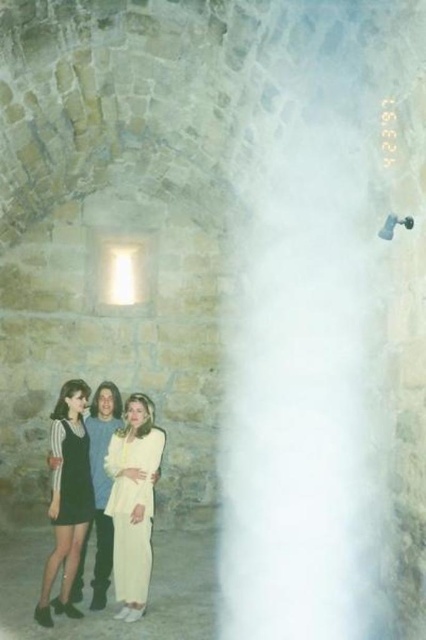
Who is shorter, light beige fabric skirt at lower left or matte black dress at left?

light beige fabric skirt at lower left

The image size is (426, 640). I want to click on light beige fabric skirt at lower left, so (x=112, y=592).

Is light yellow fabric dress at center shorter than black satin dress at left?

No.

You are a GUI agent. You are given a task and a screenshot of the screen. Output one action in this format:
    pyautogui.click(x=<x>, y=<y>)
    Task: Click on the light yellow fabric dress at center
    The image size is (426, 640).
    Given the screenshot: What is the action you would take?
    pyautogui.click(x=132, y=509)

Locate an element on the screen. The height and width of the screenshot is (640, 426). light yellow fabric dress at center is located at coordinates (132, 509).

Does light beige fabric skirt at lower left come behind light yellow fabric dress at center?

No, light beige fabric skirt at lower left is closer to the viewer.

Does light beige fabric skirt at lower left have a greater width compared to light yellow fabric dress at center?

Correct, the width of light beige fabric skirt at lower left exceeds that of light yellow fabric dress at center.

You are a GUI agent. You are given a task and a screenshot of the screen. Output one action in this format:
    pyautogui.click(x=<x>, y=<y>)
    Task: Click on the light beige fabric skirt at lower left
    Image resolution: width=426 pixels, height=640 pixels.
    Given the screenshot: What is the action you would take?
    pyautogui.click(x=112, y=592)